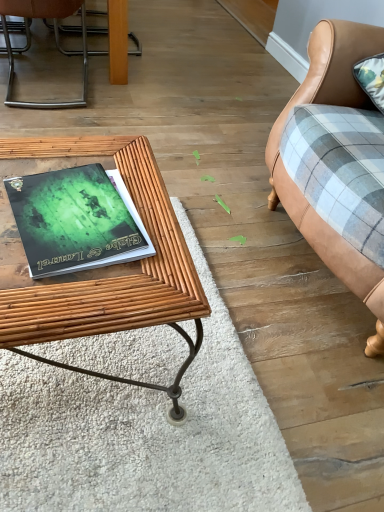
What do you see at coordinates (76, 220) in the screenshot? I see `green matte book at center` at bounding box center [76, 220].

You are a GUI agent. You are given a task and a screenshot of the screen. Output one action in this format:
    pyautogui.click(x=<x>, y=<y>)
    Task: Click on the metallic silver chair at upper left
    
    Given the screenshot: What is the action you would take?
    pyautogui.click(x=42, y=17)

Locate an element on the screen. The image size is (384, 512). bambooobject at left is located at coordinates (115, 277).

What are the coordinates of `leather couch at right` in the screenshot? It's located at (327, 103).

At what (x,y) coordinates should I click in order to perform the action: click on green matte book at center. Please return your answer as a coordinate pair (x, y). The height and width of the screenshot is (512, 384). Looking at the image, I should click on (76, 220).

Is green matte book at center completely or partially outside of leather couch at right?

Yes.

From the image's perspective, which is below, green matte book at center or leather couch at right?

green matte book at center is shown below in the image.

From a real-world perspective, does green matte book at center stand above leather couch at right?

No, from a real-world perspective, green matte book at center is not over leather couch at right

You are a GUI agent. You are given a task and a screenshot of the screen. Output one action in this format:
    pyautogui.click(x=<x>, y=<y>)
    Task: Click on the mat on the left of the leather couch at right
    This screenshot has width=384, height=512.
    Given the screenshot: What is the action you would take?
    pyautogui.click(x=146, y=432)

Considering the sizes of objects leather couch at right and green matte book at center in the image provided, who is thinner, leather couch at right or green matte book at center?

green matte book at center.

Considering the sizes of leather couch at right and green matte book at center in the image, is leather couch at right bigger or smaller than green matte book at center?

Considering their sizes, leather couch at right takes up more space than green matte book at center.

Choose the correct answer: Is leather couch at right inside green matte book at center or outside it?

The correct answer is: outside.

Which of these two, bambooobject at left or green matte book at center, is bigger?

With larger size is bambooobject at left.

Are bambooobject at left and green matte book at center making contact?

No, bambooobject at left is not next to green matte book at center.

Considering the positions of objects bambooobject at left and green matte book at center in the image provided, who is more to the right, bambooobject at left or green matte book at center?

green matte book at center is more to the right.

From a real-world perspective, is bambooobject at left positioned over green matte book at center based on gravity?

Incorrect, from a real-world perspective, bambooobject at left is lower than green matte book at center.

Is green matte book at center next to metallic silver chair at upper left?

They are not placed beside each other.

Can metallic silver chair at upper left be found inside green matte book at center?

That's incorrect, metallic silver chair at upper left is not inside green matte book at center.

Is green matte book at center to the right of metallic silver chair at upper left from the viewer's perspective?

Yes.

Based on the photo, is green matte book at center taller or shorter than metallic silver chair at upper left?

In the image, green matte book at center appears to be shorter than metallic silver chair at upper left.

Considering the sizes of objects green matte book at center and bambooobject at left in the image provided, who is bigger, green matte book at center or bambooobject at left?

With larger size is bambooobject at left.

From the image's perspective, which is below, green matte book at center or bambooobject at left?

From the image's view, green matte book at center is below.

Between point (9, 428) and point (135, 174), which one is positioned in front?

Positioned in front is point (9, 428).

Is metallic silver chair at upper left oriented towards green matte book at center?

No, metallic silver chair at upper left is not turned towards green matte book at center.

Looking at this image, from the image's perspective, which is below, metallic silver chair at upper left or green matte book at center?

From the image's view, green matte book at center is below.

Is metallic silver chair at upper left far away from green matte book at center?

Yes.

Can you confirm if metallic silver chair at upper left is smaller than green matte book at center?

Actually, metallic silver chair at upper left might be larger than green matte book at center.

Can you tell me how much leather couch at right and metallic silver chair at upper left differ in facing direction?

The facing directions of leather couch at right and metallic silver chair at upper left are 93.7 degrees apart.

Considering the relative positions of leather couch at right and metallic silver chair at upper left in the image provided, is leather couch at right to the left or to the right of metallic silver chair at upper left?

leather couch at right is to the right of metallic silver chair at upper left.

From the image's perspective, relative to metallic silver chair at upper left, is leather couch at right above or below?

leather couch at right is situated lower than metallic silver chair at upper left in the image.

Is leather couch at right with metallic silver chair at upper left?

leather couch at right is not next to metallic silver chair at upper left, and they're not touching.

Where is `studio couch above the green matte book at center (from a real-world perspective)`? Image resolution: width=384 pixels, height=512 pixels. studio couch above the green matte book at center (from a real-world perspective) is located at coordinates (327, 103).

The image size is (384, 512). Identify the location of paperback book behind the leather couch at right. (76, 220).

When comparing their distances from green matte book at center, does leather couch at right or bambooobject at left seem further?

leather couch at right is further to green matte book at center.

From the image, which object appears to be nearer to metallic silver chair at upper left, bambooobject at left or green matte book at center?

Among the two, bambooobject at left is located nearer to metallic silver chair at upper left.

When comparing their distances from bambooobject at left, does metallic silver chair at upper left or green matte book at center seem closer?

green matte book at center lies closer to bambooobject at left than the other object.

Estimate the real-world distances between objects in this image. Which object is closer to green matte book at center, leather couch at right or metallic silver chair at upper left?

Based on the image, leather couch at right appears to be nearer to green matte book at center.

Which object lies further to the anchor point metallic silver chair at upper left, bambooobject at left or green matte book at center?

The object further to metallic silver chair at upper left is green matte book at center.

Which object lies nearer to the anchor point leather couch at right, bambooobject at left or metallic silver chair at upper left?

Among the two, bambooobject at left is located nearer to leather couch at right.

Looking at this image, looking at the image, which one is located closer to green matte book at center, bambooobject at left or metallic silver chair at upper left?

Based on the image, bambooobject at left appears to be nearer to green matte book at center.

Estimate the real-world distances between objects in this image. Which object is further from bambooobject at left, green matte book at center or leather couch at right?

The object further to bambooobject at left is leather couch at right.

Where is `table between metallic silver chair at upper left and green matte book at center from top to bottom`? table between metallic silver chair at upper left and green matte book at center from top to bottom is located at coordinates (115, 277).

Where is `mat between metallic silver chair at upper left and leather couch at right`? The width and height of the screenshot is (384, 512). mat between metallic silver chair at upper left and leather couch at right is located at coordinates (146, 432).

What are the coordinates of `paperback book between metallic silver chair at upper left and green matte book at center in the up-down direction` in the screenshot? It's located at (76, 220).

Where is `table between metallic silver chair at upper left and leather couch at right from left to right`? table between metallic silver chair at upper left and leather couch at right from left to right is located at coordinates (115, 277).